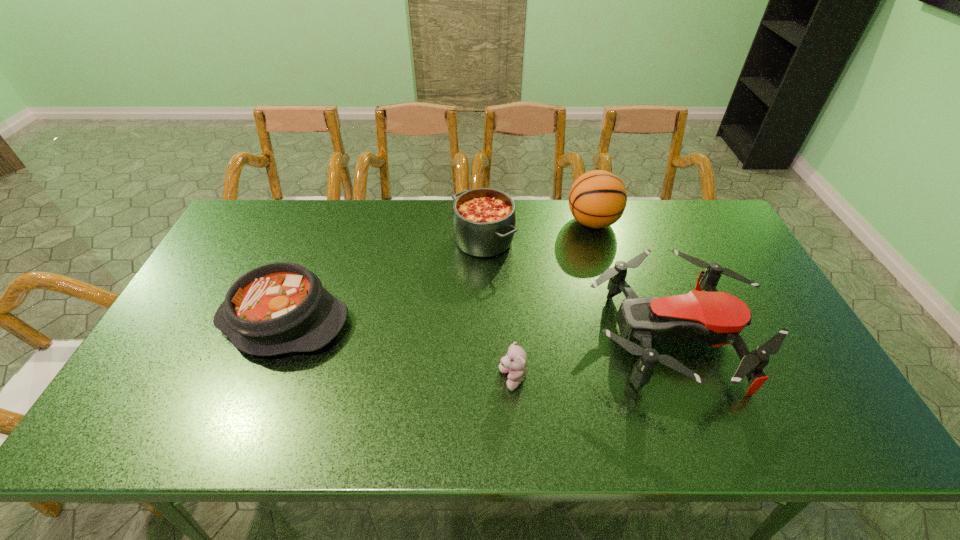
Locate an element on the screen. free space located on the camera side of the drone is located at coordinates (477, 338).

You are a GUI agent. You are given a task and a screenshot of the screen. Output one action in this format:
    pyautogui.click(x=<x>, y=<y>)
    Task: Click on the free location located on the back of the left casserole
    
    Given the screenshot: What is the action you would take?
    pyautogui.click(x=320, y=234)

Image resolution: width=960 pixels, height=540 pixels. I want to click on vacant space located 0.310m at the face of the teddy bear, so coord(372,380).

Where is `free spot located at the face of the teddy bear`? This screenshot has height=540, width=960. free spot located at the face of the teddy bear is located at coordinates coord(470,380).

I want to click on vacant space located at the face of the teddy bear, so click(351, 380).

Locate an element on the screen. This screenshot has height=540, width=960. basketball positioned at the far edge is located at coordinates (597, 199).

Image resolution: width=960 pixels, height=540 pixels. In order to click on casserole situated at the far edge in this screenshot , I will do `click(484, 220)`.

I want to click on object present at the near edge, so click(x=717, y=318).

Identify the location of object at the left edge. (277, 308).

The width and height of the screenshot is (960, 540). In order to click on object that is at the right edge in this screenshot , I will do `click(717, 318)`.